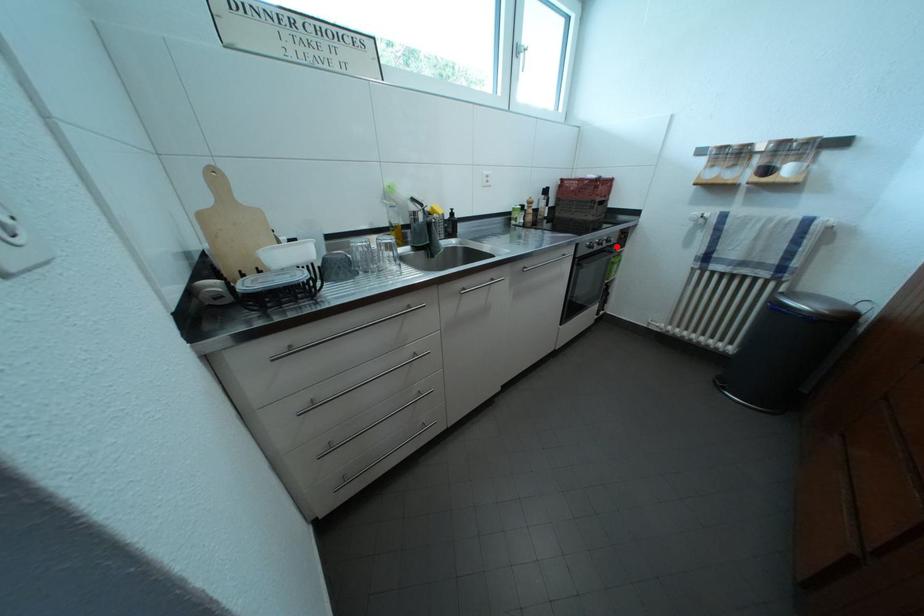
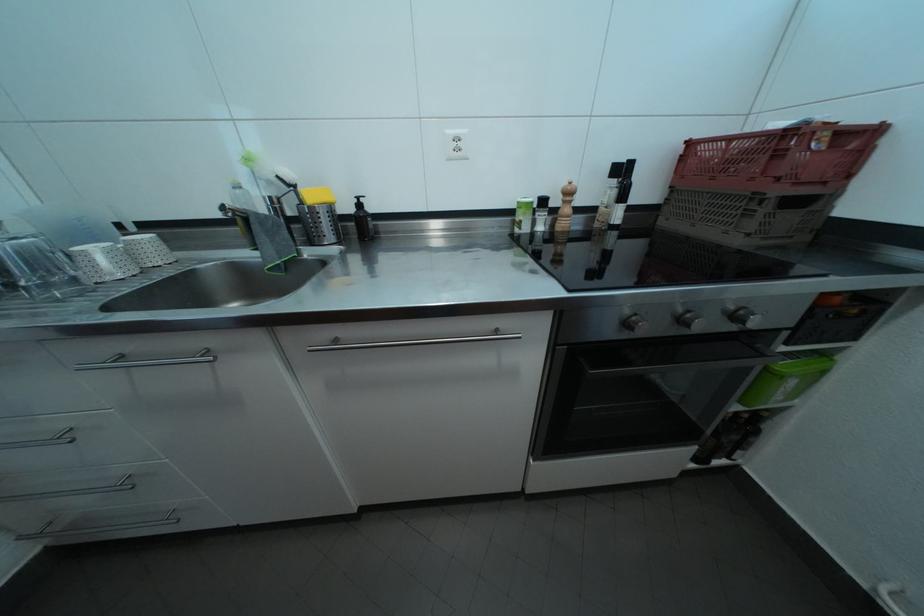
Where in the second image is the point corresponding to the highlighted location from the first image?

(745, 323)